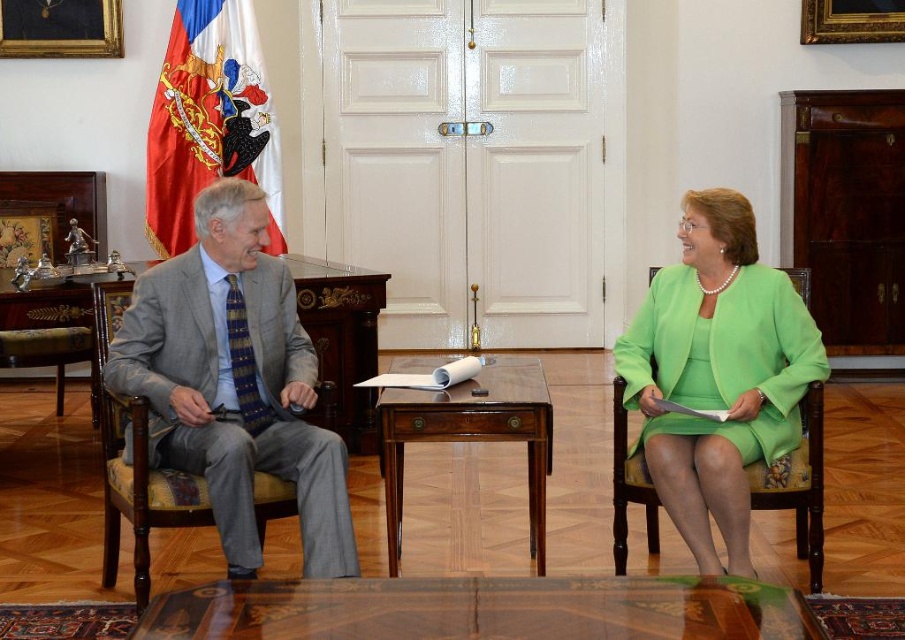
Is point (681, 273) closer to viewer compared to point (591, 605)?

No, (681, 273) is behind (591, 605).

Locate an element on the screen. Image resolution: width=905 pixels, height=640 pixels. green satin dress at right is located at coordinates (717, 372).

This screenshot has width=905, height=640. I want to click on green satin dress at right, so click(717, 372).

Does red fabric flag at upper left have a larger size compared to mahogany wood table at center?

No.

Can you confirm if red fabric flag at upper left is smaller than mahogany wood table at center?

Yes, red fabric flag at upper left is smaller than mahogany wood table at center.

Is point (188, 166) closer to viewer compared to point (540, 509)?

No, it is not.

Locate an element on the screen. red fabric flag at upper left is located at coordinates (208, 122).

Between green satin dress at right and red fabric flag at upper left, which one is positioned lower?

green satin dress at right is below.

Does green satin dress at right appear on the right side of red fabric flag at upper left?

Indeed, green satin dress at right is positioned on the right side of red fabric flag at upper left.

Identify the location of green satin dress at right. Image resolution: width=905 pixels, height=640 pixels. (717, 372).